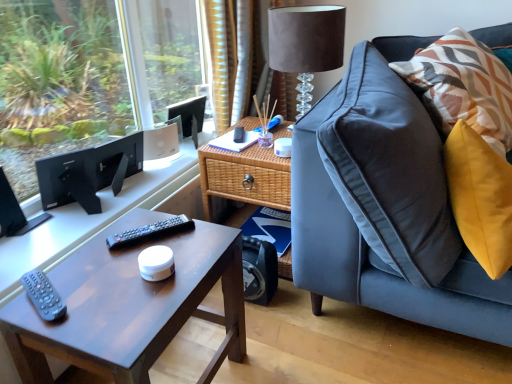
Locate an element on the screen. free space behind black plastic remote at center, which appears as the 1th remote when viewed from the right is located at coordinates (155, 219).